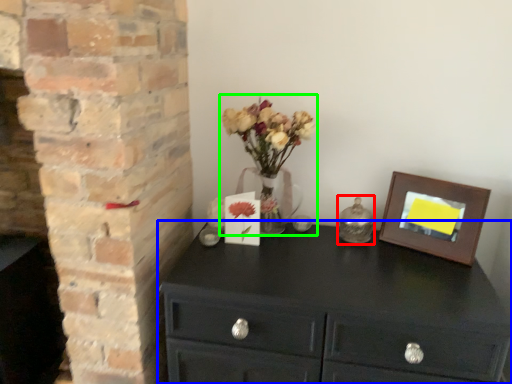
Question: Based on their relative distances, which object is nearer to candle holder (highlighted by a red box)? Choose from chest of drawers (highlighted by a blue box) and floral arrangement (highlighted by a green box).

Choices:
 (A) chest of drawers
 (B) floral arrangement

Answer: (B)